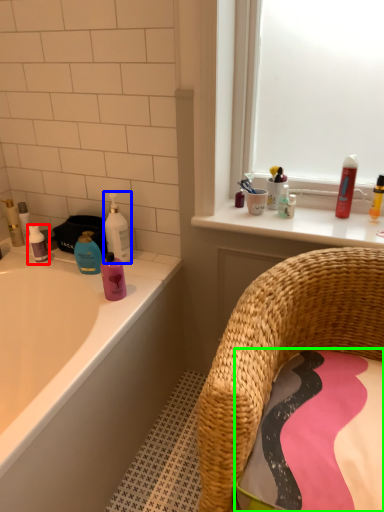
Question: Estimate the real-world distances between objects in this image. Which object is closer to mouthwash (highlighted by a red box), cleaning product (highlighted by a blue box) or bath towel (highlighted by a green box)?

Choices:
 (A) cleaning product
 (B) bath towel

Answer: (A)